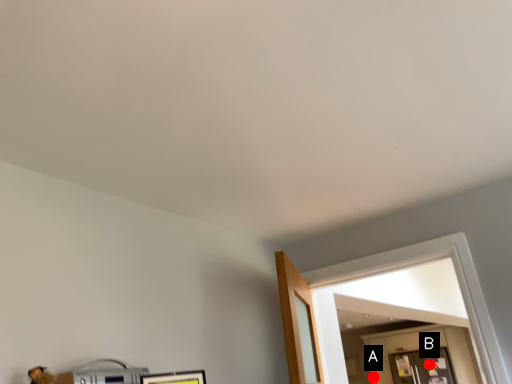
Question: Two points are circled on the image, labeled by A and B beside each circle. Which point is farther from the camera taking this photo?

Choices:
 (A) A is further
 (B) B is further

Answer: (A)